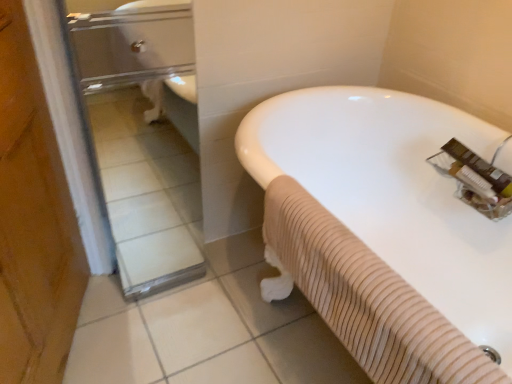
Identify the location of vacant space underneath clear glass door at left (from a real-world perspective). (172, 274).